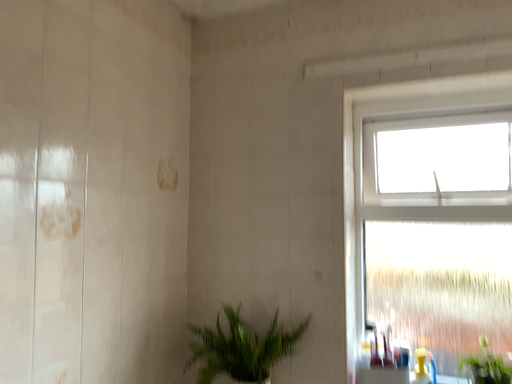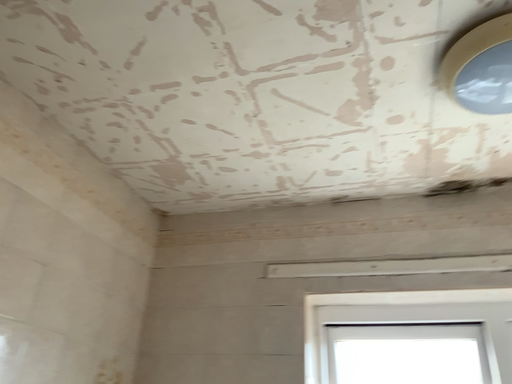
Question: Which way did the camera rotate in the video?

Choices:
 (A) rotated upward
 (B) rotated downward

Answer: (A)